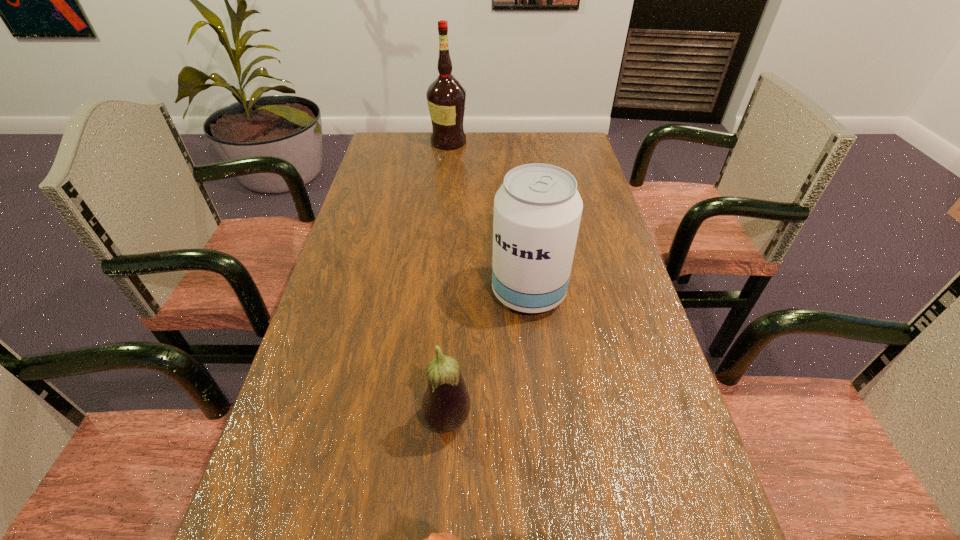
Locate an element on the screen. The height and width of the screenshot is (540, 960). the farthest object is located at coordinates (446, 97).

This screenshot has width=960, height=540. What are the coordinates of `the tallest object` in the screenshot? It's located at (446, 97).

This screenshot has height=540, width=960. Identify the location of the second tallest object. (537, 210).

Identify the location of the right alcohol. (537, 210).

The width and height of the screenshot is (960, 540). Identify the location of the second nearest object. pos(445,406).

Where is `vacant area situated 0.140m on the label of the tallest object`? vacant area situated 0.140m on the label of the tallest object is located at coordinates (505, 142).

This screenshot has height=540, width=960. In order to click on free space located on the left of the second farthest object in this screenshot , I will do `click(438, 293)`.

Identify the location of vacant space situated 0.230m on the right of the eggplant. The height and width of the screenshot is (540, 960). (593, 421).

You are a GUI agent. You are given a task and a screenshot of the screen. Output one action in this format:
    pyautogui.click(x=<x>, y=<y>)
    Task: Click on the object at the far edge
    This screenshot has width=960, height=540.
    Given the screenshot: What is the action you would take?
    pyautogui.click(x=446, y=97)

I want to click on free space at the far edge of the desktop, so click(490, 161).